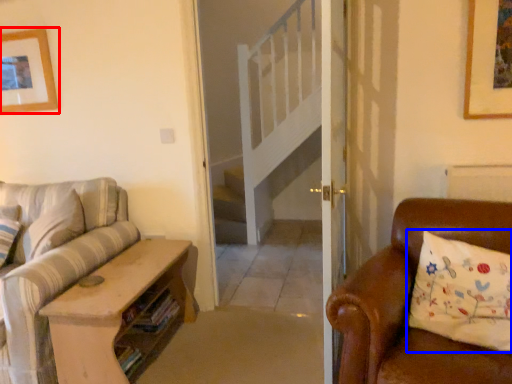
Question: Among these objects, which one is farthest to the camera, picture frame (highlighted by a red box) or pillow (highlighted by a blue box)?

Choices:
 (A) picture frame
 (B) pillow

Answer: (A)